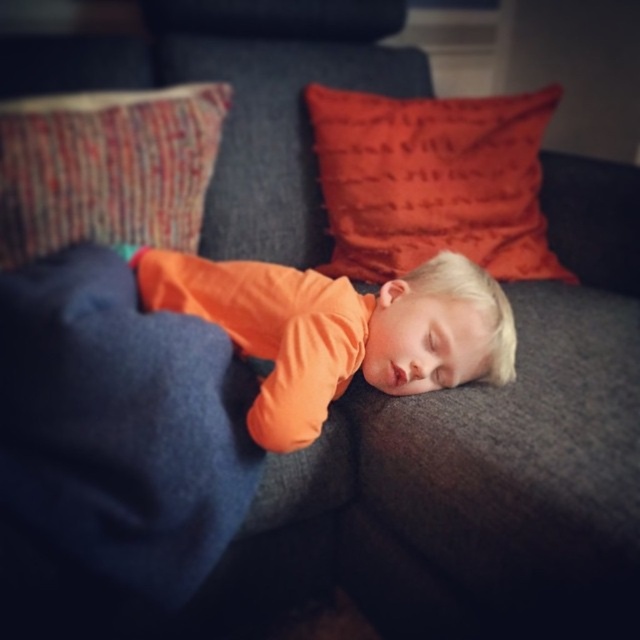
Question: Which of the following is the farthest from the observer?

Choices:
 (A) (396, 184)
 (B) (413, 308)
 (C) (74, 141)

Answer: (A)

Question: Can you confirm if orange soft fabric toddler at center is positioned above velvety orange pillow at upper right?

Choices:
 (A) no
 (B) yes

Answer: (A)

Question: Estimate the real-world distances between objects in this image. Which object is farther from the textured woven pillow at upper left?

Choices:
 (A) velvety orange pillow at upper right
 (B) orange soft fabric toddler at center

Answer: (A)

Question: Is velvety orange pillow at upper right thinner than textured woven pillow at upper left?

Choices:
 (A) no
 (B) yes

Answer: (A)

Question: Does orange soft fabric toddler at center appear on the left side of textured woven pillow at upper left?

Choices:
 (A) no
 (B) yes

Answer: (A)

Question: Which point is farther to the camera?

Choices:
 (A) (160, 236)
 (B) (337, 392)
 (C) (339, 176)

Answer: (C)